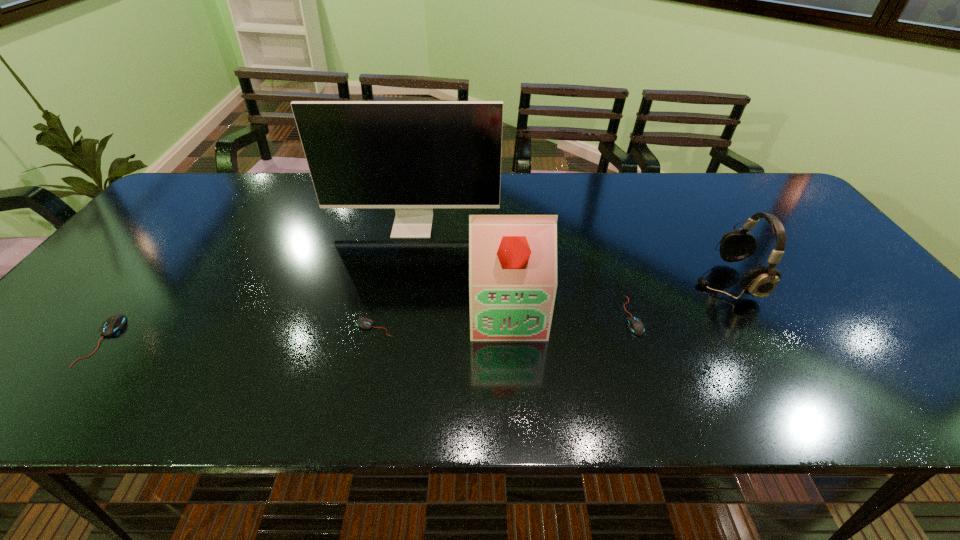
Where is `the rightmost object`? Image resolution: width=960 pixels, height=540 pixels. the rightmost object is located at coordinates (760, 281).

You are a GUI agent. You are given a task and a screenshot of the screen. Output one action in this format:
    pyautogui.click(x=<x>, y=<y>)
    Task: Click on the vacant space positioned on the back of the tallest mouse
    Image resolution: width=960 pixels, height=540 pixels.
    Given the screenshot: What is the action you would take?
    pyautogui.click(x=176, y=248)

Locate an element on the screen. free spot located on the right of the shortest object is located at coordinates (526, 328).

Image resolution: width=960 pixels, height=540 pixels. I want to click on vacant space located 0.400m on the back of the second object from right to left, so click(594, 205).

Locate an element on the screen. Image resolution: width=960 pixels, height=540 pixels. vacant area situated on the front-facing side of the tallest object is located at coordinates (407, 256).

The image size is (960, 540). What are the coordinates of `vacant region located 0.050m with the cap open on the fifth shortest object` in the screenshot? It's located at (511, 360).

The image size is (960, 540). I want to click on vacant space located with the microphone on the side of the headset, so click(636, 280).

Locate an element on the screen. This screenshot has width=960, height=540. free space located with the microphone on the side of the headset is located at coordinates (636, 280).

Locate an element on the screen. The width and height of the screenshot is (960, 540). vacant space located with the microphone on the side of the headset is located at coordinates (549, 280).

You are a GUI agent. You are given a task and a screenshot of the screen. Output one action in this format:
    pyautogui.click(x=<x>, y=<y>)
    Task: Click on the object present at the far edge
    This screenshot has height=540, width=960.
    Given the screenshot: What is the action you would take?
    pyautogui.click(x=413, y=156)